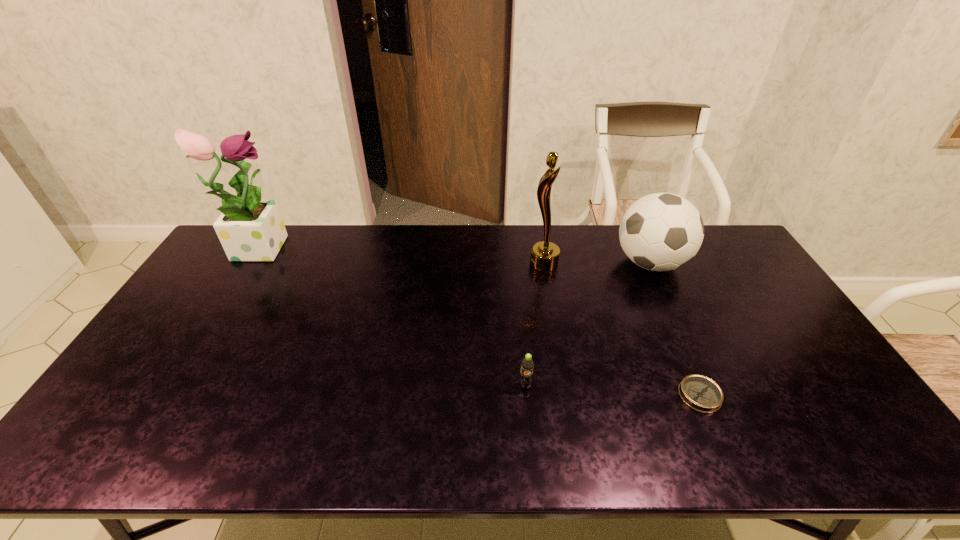
The height and width of the screenshot is (540, 960). Find the location of `free space at the left edge`. free space at the left edge is located at coordinates (148, 416).

You are a GUI agent. You are given a task and a screenshot of the screen. Output one action in this format:
    pyautogui.click(x=<x>, y=<y>)
    Task: Click on the free space at the right edge of the desktop
    The width and height of the screenshot is (960, 540).
    Given the screenshot: What is the action you would take?
    pyautogui.click(x=761, y=282)

In order to click on free space between the fourth object from right to left and the award in this screenshot , I will do click(535, 325).

At what (x,y) coordinates should I click in order to perform the action: click on free space between the award and the leftmost object. Please return your answer as a coordinate pair (x, y). This screenshot has height=540, width=960. Looking at the image, I should click on pos(401,254).

The image size is (960, 540). Identify the location of free space between the compass and the flower arrangement. (480, 320).

In order to click on free space between the shortest object and the award in this screenshot , I will do `click(622, 329)`.

What are the coordinates of `free space between the flower arrangement and the soccer ball` in the screenshot? It's located at (455, 254).

Where is `free spot between the third object from right to left and the second object from left to right`? This screenshot has height=540, width=960. free spot between the third object from right to left and the second object from left to right is located at coordinates (535, 325).

You are a GUI agent. You are given a task and a screenshot of the screen. Output one action in this format:
    pyautogui.click(x=<x>, y=<y>)
    Task: Click on the free space that is in between the compass and the second shortest object
    This screenshot has height=540, width=960.
    Given the screenshot: What is the action you would take?
    pyautogui.click(x=612, y=390)

Image resolution: width=960 pixels, height=540 pixels. What are the coordinates of `vacant area between the compass and the third object from right to left` in the screenshot? It's located at pyautogui.click(x=622, y=329).